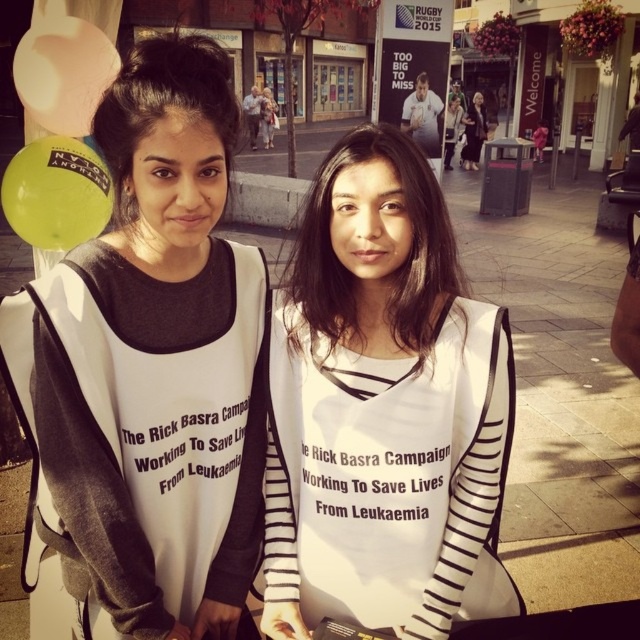
Is white jersey at left smaller than matte black shirt at upper center?

Indeed, white jersey at left has a smaller size compared to matte black shirt at upper center.

What do you see at coordinates (157, 364) in the screenshot? Image resolution: width=640 pixels, height=640 pixels. I see `white jersey at left` at bounding box center [157, 364].

Identify the location of white jersey at left. (157, 364).

Is white striped shirt at center smaller than black matte hair at upper left?

Actually, white striped shirt at center might be larger than black matte hair at upper left.

Is point (301, 612) closer to viewer compared to point (131, 65)?

No, (301, 612) is further to viewer.

I want to click on white striped shirt at center, so click(x=384, y=410).

Between green rubber balloon at upper left and matte black shirt at upper center, which one appears on the right side from the viewer's perspective?

matte black shirt at upper center

I want to click on green rubber balloon at upper left, so click(x=56, y=193).